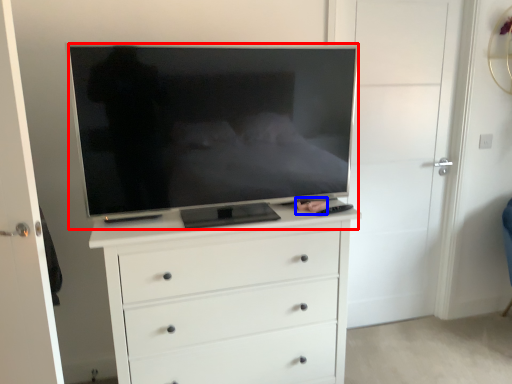
Question: Which of the following is the closest to the observer, television (highlighted by a red box) or person (highlighted by a blue box)?

Choices:
 (A) television
 (B) person

Answer: (A)